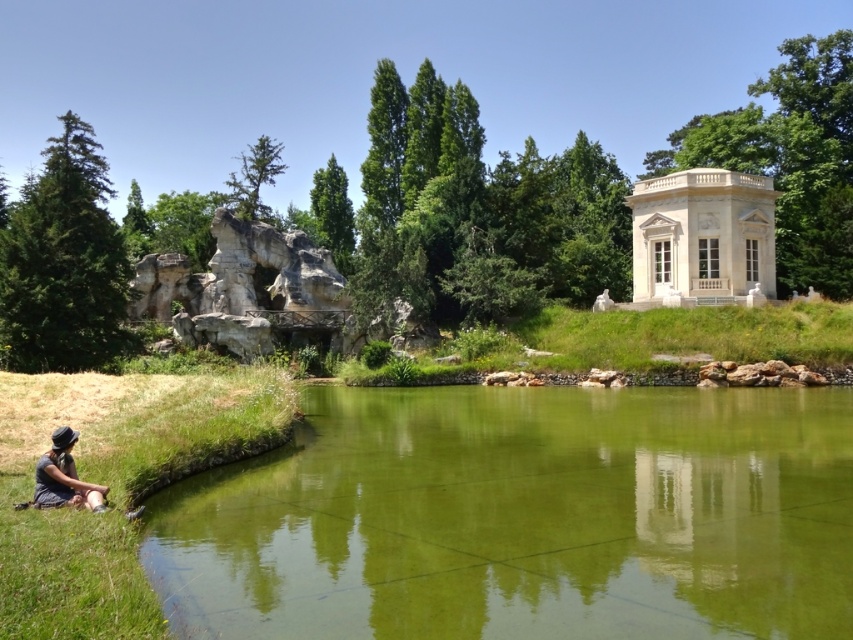
Based on the photo, you are a photographer planning to take a photo of the green smooth water at center and the white marble pavilion at upper right. Which object should you focus on first if you want to capture both in a single shot without moving the camera?

You should focus on the white marble pavilion at upper right first because it is taller than the green smooth water at center, allowing you to frame both objects within the camera view effectively.

You are standing at the edge of the pond and want to take a photo of the white marble pavilion at upper right without any obstructions. Is the matte black hat at lower left blocking your view of the pavilion?

The matte black hat at lower left is behind the white marble pavilion at upper right, so it is not blocking your view of the pavilion. You can take the photo without any obstructions.